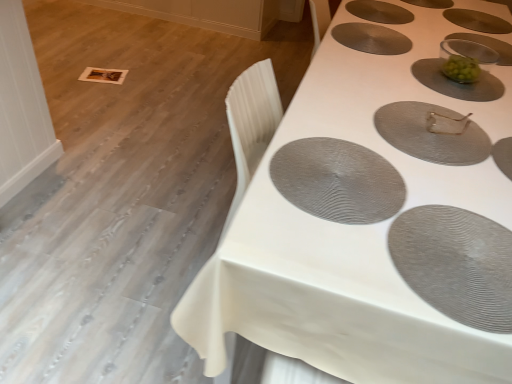
Where is `vacant region to the left of green matte bowl at upper right, which is the fourth oval from back to front`? vacant region to the left of green matte bowl at upper right, which is the fourth oval from back to front is located at coordinates (369, 72).